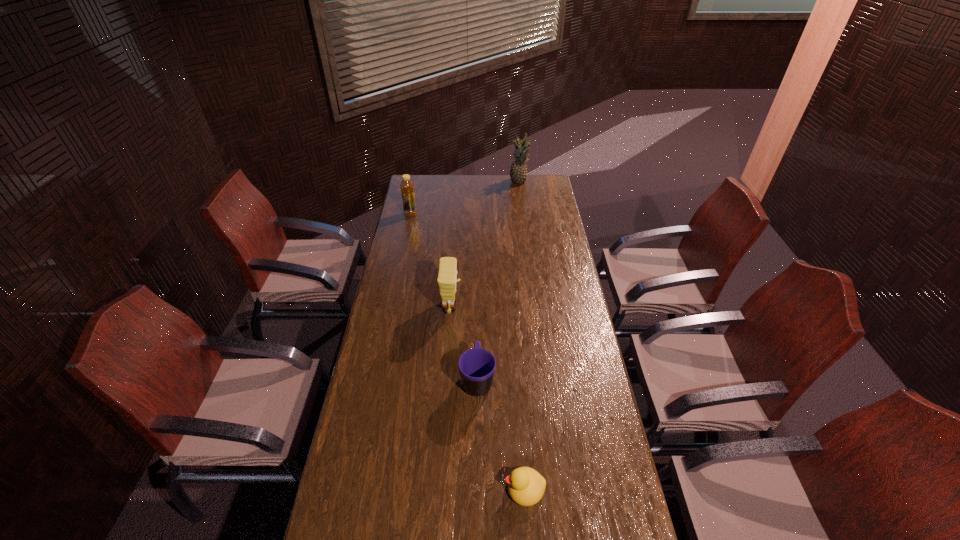
Identify the location of object located at the left edge. (407, 188).

Where is `object present at the right edge`? This screenshot has height=540, width=960. object present at the right edge is located at coordinates (518, 173).

I want to click on object present at the far right corner, so click(518, 173).

Where is `vacant point at the far edge`? Image resolution: width=960 pixels, height=540 pixels. vacant point at the far edge is located at coordinates 485,193.

In the image, there is a desktop. Identify the location of vacant space at the left edge. This screenshot has width=960, height=540. (400, 358).

Find the location of a particular element. free space at the right edge is located at coordinates (583, 310).

Where is `vacant space at the far right corner of the desktop`? This screenshot has width=960, height=540. vacant space at the far right corner of the desktop is located at coordinates (554, 196).

At what (x,y) coordinates should I click in order to perform the action: click on vacant area between the leftmost object and the tallest object. Please return your answer as a coordinate pair (x, y). Looking at the image, I should click on (465, 198).

The image size is (960, 540). I want to click on vacant space that is in between the mug and the duckling, so [501, 434].

This screenshot has width=960, height=540. I want to click on free space between the third farthest object and the bottle, so click(x=431, y=260).